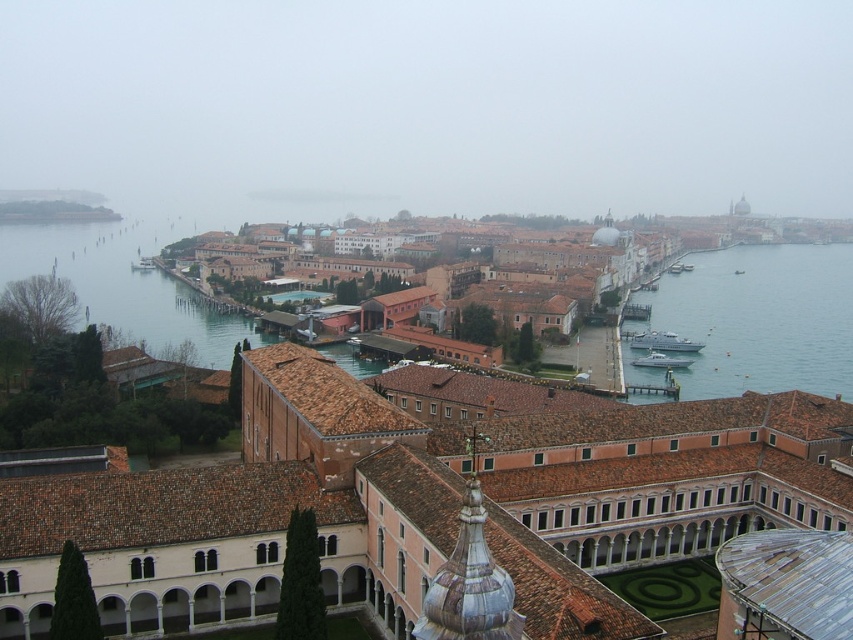
Question: Can you confirm if brown brick buildings at center is bigger than metallic gray boat at center?

Choices:
 (A) no
 (B) yes

Answer: (B)

Question: Does clear blue water at lower left have a greater width compared to silver metallic boat at center-right?

Choices:
 (A) yes
 (B) no

Answer: (A)

Question: Is brown brick buildings at center positioned behind white plastic boat at lower left?

Choices:
 (A) no
 (B) yes

Answer: (A)

Question: Based on their relative distances, which object is nearer to the metallic gray boat at center?

Choices:
 (A) silver metallic boat at center-right
 (B) white plastic boat at lower left
 (C) brown brick buildings at center

Answer: (A)

Question: Which point is closer to the camera?

Choices:
 (A) (393, 413)
 (B) (144, 324)

Answer: (A)

Question: Based on their relative distances, which object is nearer to the clear blue water at right?

Choices:
 (A) brown tile roof at center
 (B) white plastic boat at lower left
 (C) brown brick buildings at center

Answer: (C)